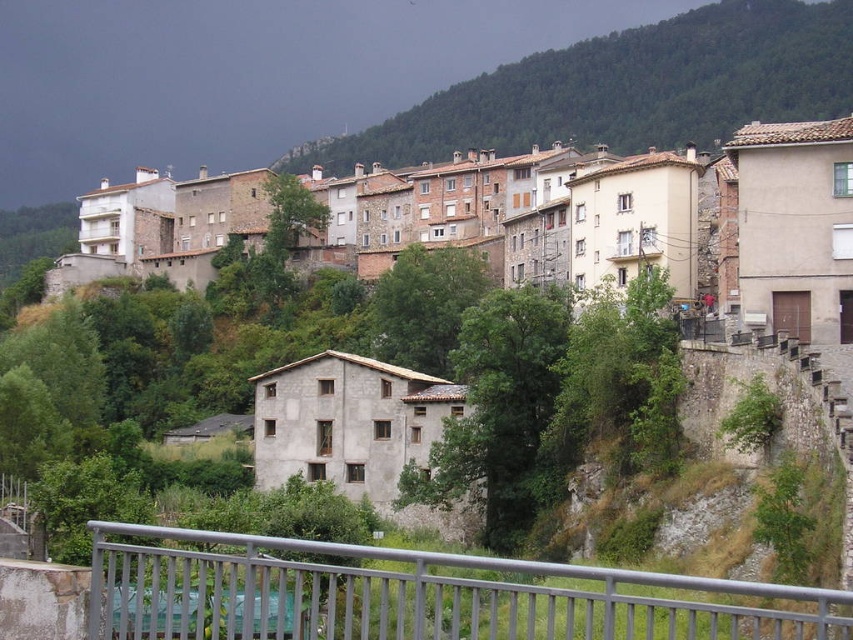
Question: Does stone houses at upper center have a lesser width compared to green textured hillside at upper center?

Choices:
 (A) yes
 (B) no

Answer: (A)

Question: Is stone houses at upper center thinner than silver metallic railing at lower center?

Choices:
 (A) no
 (B) yes

Answer: (A)

Question: Based on their relative distances, which object is farther from the stone houses at upper center?

Choices:
 (A) green textured hillside at upper center
 (B) silver metallic railing at lower center

Answer: (A)

Question: Observing the image, what is the correct spatial positioning of stone houses at upper center in reference to green textured hillside at upper center?

Choices:
 (A) above
 (B) below

Answer: (B)

Question: Which object is the closest to the green textured hillside at upper center?

Choices:
 (A) stone houses at upper center
 (B) silver metallic railing at lower center

Answer: (A)

Question: Among these objects, which one is farthest from the camera?

Choices:
 (A) green textured hillside at upper center
 (B) silver metallic railing at lower center

Answer: (A)